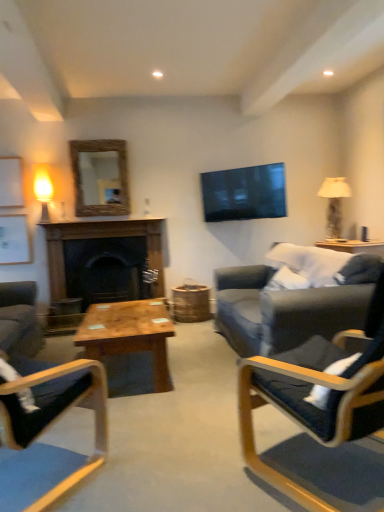
Question: Considering the relative sizes of dark wood fireplace at center and white fabric lampshade at right, positioned as the 2th lamp in left-to-right order, in the image provided, is dark wood fireplace at center thinner than white fabric lampshade at right, positioned as the 2th lamp in left-to-right order,?

Choices:
 (A) no
 (B) yes

Answer: (B)

Question: From a real-world perspective, does dark wood fireplace at center sit lower than white fabric lampshade at right, positioned as the 2th lamp in left-to-right order?

Choices:
 (A) yes
 (B) no

Answer: (A)

Question: Is dark wood fireplace at center positioned before white fabric lampshade at right, positioned as the 2th lamp in left-to-right order?

Choices:
 (A) yes
 (B) no

Answer: (A)

Question: Is dark wood fireplace at center far away from white fabric lampshade at right, positioned as the 2th lamp in left-to-right order?

Choices:
 (A) yes
 (B) no

Answer: (A)

Question: From the image's perspective, is dark wood fireplace at center on top of white fabric lampshade at right, positioned as the 2th lamp in left-to-right order?

Choices:
 (A) yes
 (B) no

Answer: (B)

Question: Is dark wood fireplace at center positioned beyond the bounds of white fabric lampshade at right, which is the 1th lamp in right-to-left order?

Choices:
 (A) yes
 (B) no

Answer: (A)

Question: From a real-world perspective, is matte glass lamp at left, placed as the 2th lamp when sorted from right to left, below wooden armchair at center, which appears as the second chair when viewed from the right?

Choices:
 (A) yes
 (B) no

Answer: (B)

Question: Can you confirm if matte glass lamp at left, placed as the 2th lamp when sorted from right to left, is taller than wooden armchair at center, which appears as the second chair when viewed from the right?

Choices:
 (A) no
 (B) yes

Answer: (A)

Question: Is matte glass lamp at left, which is the first lamp from left to right, oriented towards wooden armchair at center, which appears as the second chair when viewed from the right?

Choices:
 (A) yes
 (B) no

Answer: (A)

Question: From a real-world perspective, is matte glass lamp at left, placed as the 2th lamp when sorted from right to left, on top of wooden armchair at center, the first chair viewed from the left?

Choices:
 (A) no
 (B) yes

Answer: (B)

Question: Can you confirm if matte glass lamp at left, placed as the 2th lamp when sorted from right to left, is thinner than wooden armchair at center, the first chair viewed from the left?

Choices:
 (A) yes
 (B) no

Answer: (A)

Question: Is matte glass lamp at left, which is the first lamp from left to right, surrounding wooden armchair at center, the first chair viewed from the left?

Choices:
 (A) no
 (B) yes

Answer: (A)

Question: From the image's perspective, does white fabric lampshade at right, which is the 1th lamp in right-to-left order, appear lower than wooden coffee table at center?

Choices:
 (A) yes
 (B) no

Answer: (B)